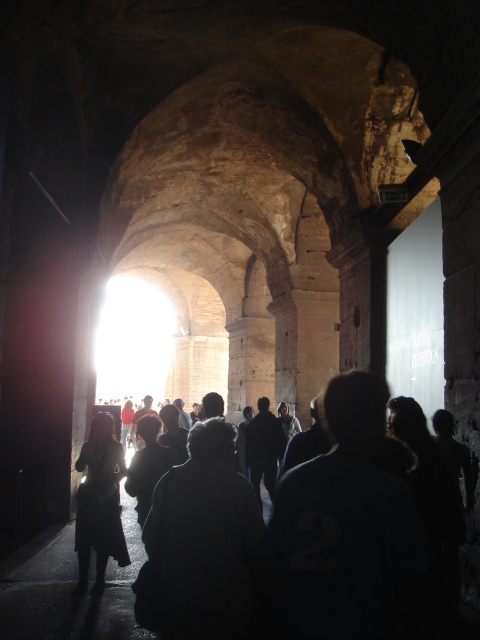
Question: In this image, where is dark fabric jacket at center located relative to dark hair at center?

Choices:
 (A) above
 (B) below

Answer: (A)

Question: Can you confirm if dark fabric jacket at center is positioned to the right of dark hair at center?

Choices:
 (A) no
 (B) yes

Answer: (B)

Question: Which point is closer to the camera?

Choices:
 (A) dark fabric jacket at center
 (B) dark hair at center

Answer: (A)

Question: Among these objects, which one is nearest to the camera?

Choices:
 (A) dark fabric jacket at center
 (B) dark hair at center

Answer: (A)

Question: Is dark fabric jacket at center to the right of dark hair at center from the viewer's perspective?

Choices:
 (A) yes
 (B) no

Answer: (A)